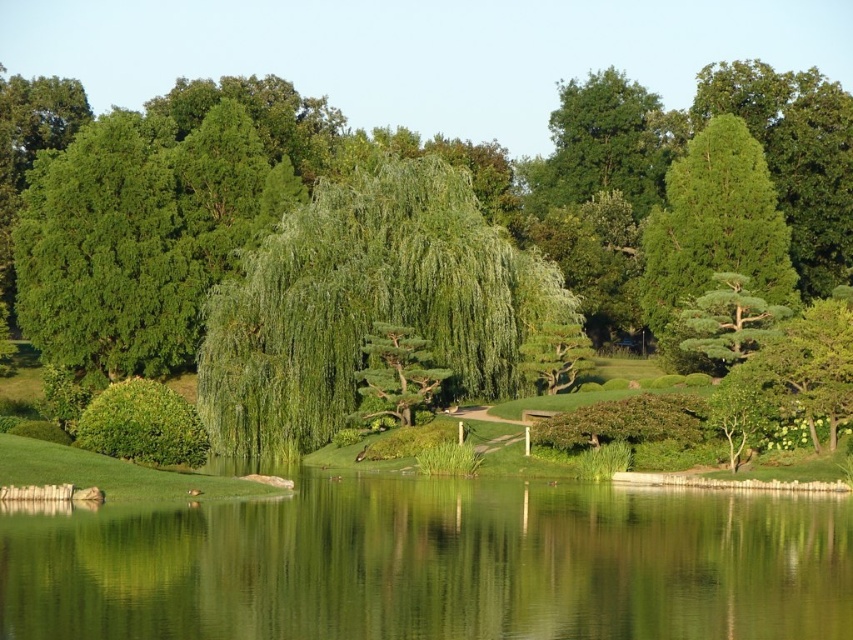
Which of these two, green reflective water at center or green leafy tree at center, stands shorter?

green reflective water at center is shorter.

Does green reflective water at center have a smaller size compared to green leafy tree at center?

Yes.

Consider the image. Measure the distance between green reflective water at center and camera.

The distance of green reflective water at center from camera is 22.09 meters.

Identify the location of green reflective water at center. This screenshot has width=853, height=640. (434, 564).

Does green reflective water at center appear on the right side of green leafy willow at center?

Correct, you'll find green reflective water at center to the right of green leafy willow at center.

Can you confirm if green reflective water at center is smaller than green leafy willow at center?

Indeed, green reflective water at center has a smaller size compared to green leafy willow at center.

Between point (570, 509) and point (233, 378), which one is positioned behind?

The point (233, 378) is more distant.

This screenshot has width=853, height=640. What are the coordinates of `green reflective water at center` in the screenshot? It's located at (434, 564).

Does green leafy tree at center have a larger size compared to green leafy willow at center?

Yes, green leafy tree at center is bigger than green leafy willow at center.

The height and width of the screenshot is (640, 853). What are the coordinates of `green leafy tree at center` in the screenshot? It's located at (x=350, y=172).

Between point (752, 72) and point (259, 426), which one is positioned behind?

The point (752, 72) is behind.

At what (x,y) coordinates should I click in order to perform the action: click on green leafy tree at center. Please return your answer as a coordinate pair (x, y). Looking at the image, I should click on (350, 172).